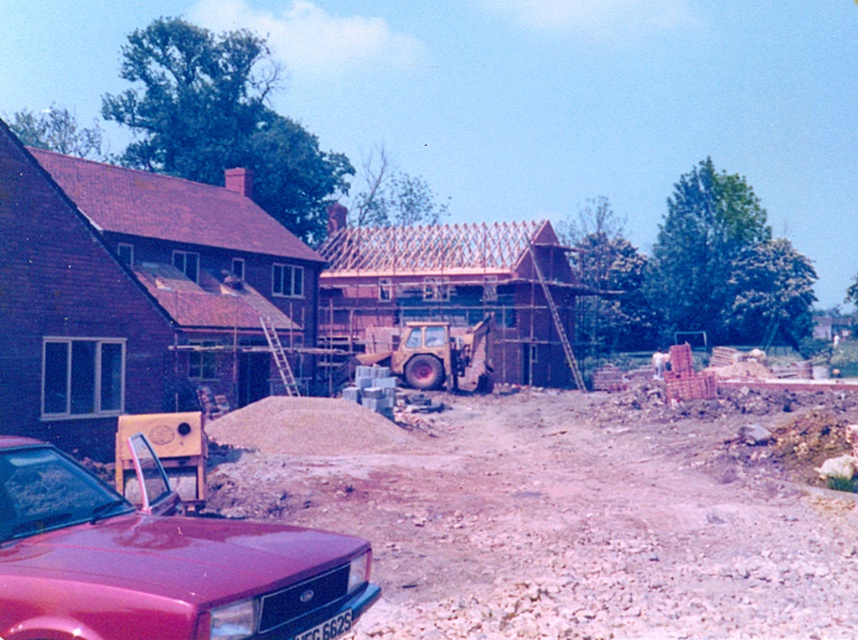
Question: Which point is closer to the camera?

Choices:
 (A) shiny red car at lower left
 (B) yellow rubber excavator at center

Answer: (A)

Question: Is brown gravel at center thinner than shiny red car at lower left?

Choices:
 (A) yes
 (B) no

Answer: (B)

Question: Which point is farther to the camera?

Choices:
 (A) (451, 358)
 (B) (388, 596)
 (C) (286, 609)

Answer: (A)

Question: Among these objects, which one is nearest to the camera?

Choices:
 (A) shiny red car at lower left
 (B) yellow rubber excavator at center

Answer: (A)

Question: Can you confirm if brown gravel at center is smaller than yellow rubber excavator at center?

Choices:
 (A) yes
 (B) no

Answer: (B)

Question: Is brown gravel at center thinner than shiny red car at lower left?

Choices:
 (A) yes
 (B) no

Answer: (B)